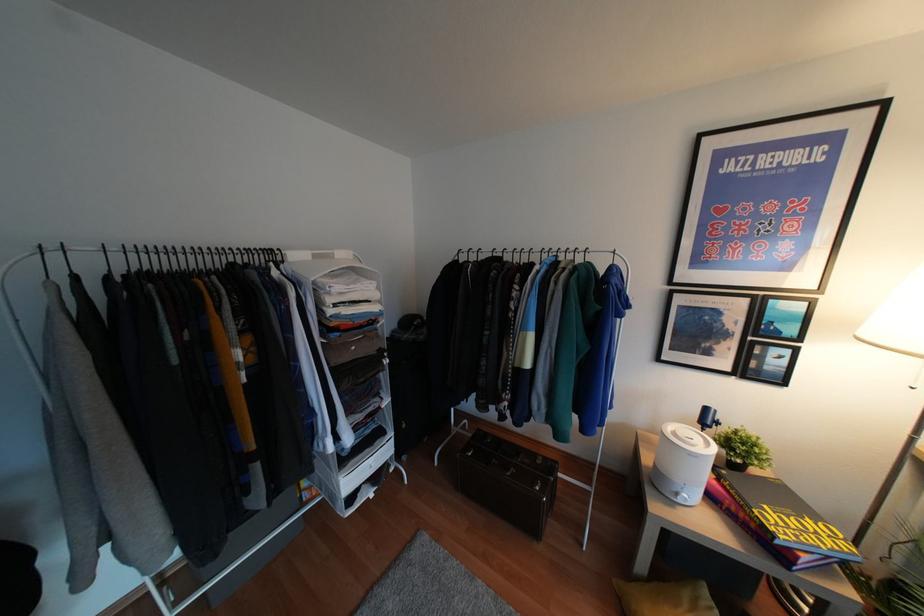
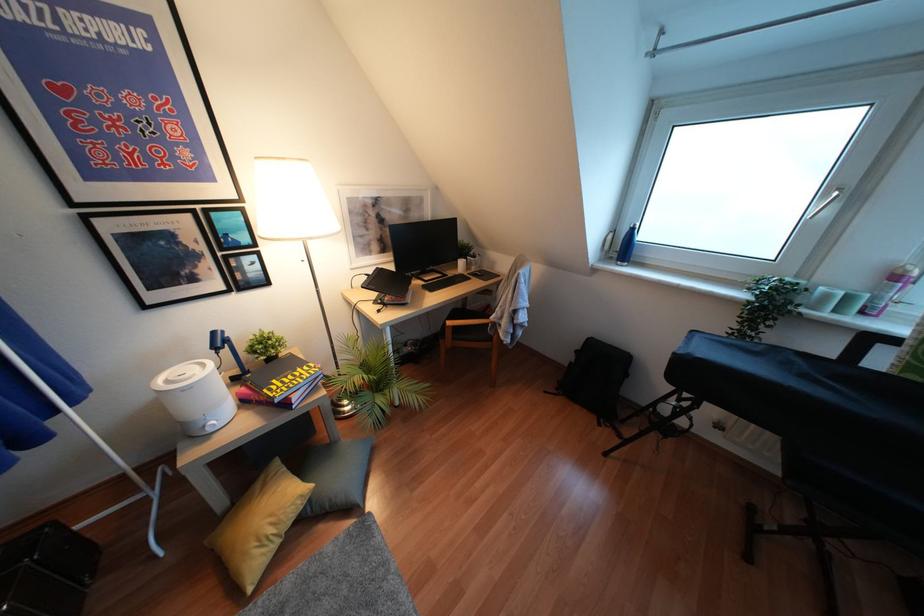
Find the pixel in the second image that matches (x=678, y=500) in the first image.

(210, 430)